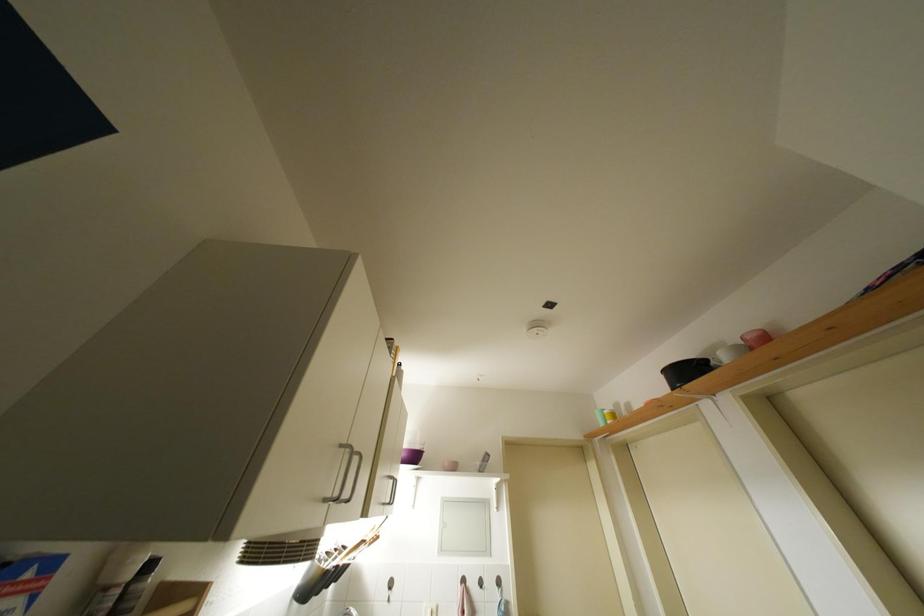
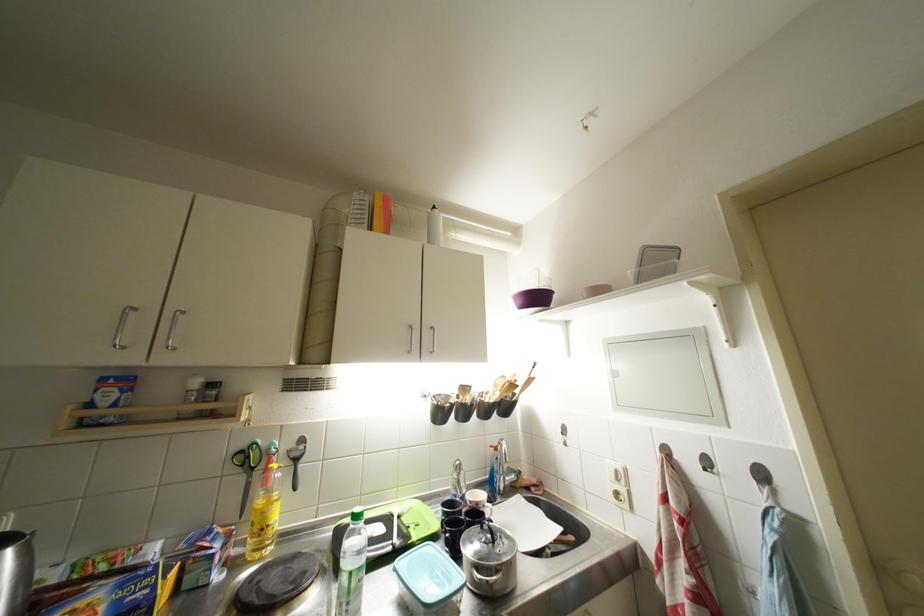
The point at (410, 459) is marked in the first image. Where is the corresponding point in the second image?

(527, 306)